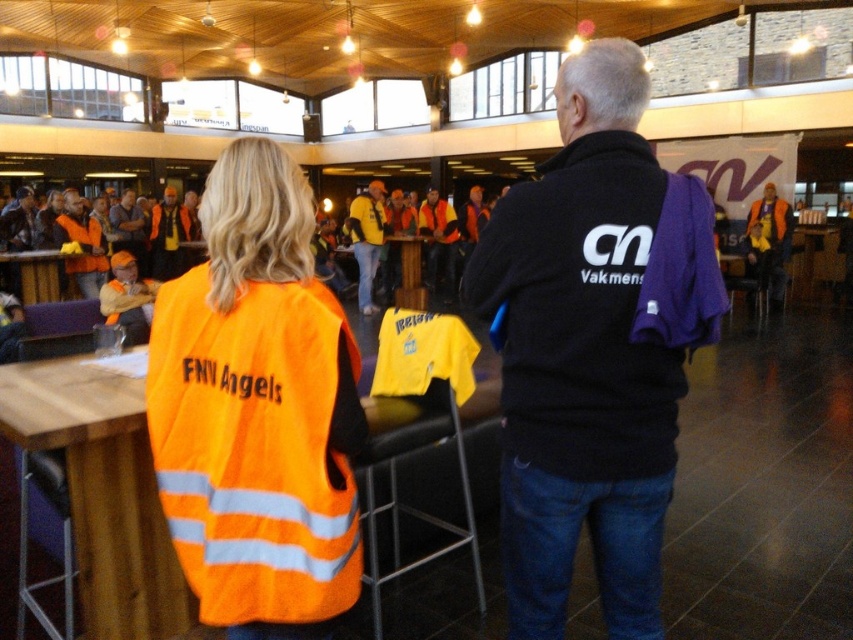
Question: Among these points, which one is nearest to the camera?

Choices:
 (A) click(x=41, y=294)
 (B) click(x=770, y=196)
 (C) click(x=401, y=272)

Answer: (A)

Question: Which point is closer to the camera?

Choices:
 (A) (196, 289)
 (B) (368, 289)
 (C) (35, 260)

Answer: (A)

Question: Is reflective orange vest at center to the right of orange reflective vest at center from the viewer's perspective?

Choices:
 (A) yes
 (B) no

Answer: (B)

Question: Is reflective orange vest at center thinner than yellow fabric shirt at center?

Choices:
 (A) yes
 (B) no

Answer: (B)

Question: Is black fleece jacket at center closer to camera compared to yellow fabric shirt at center?

Choices:
 (A) no
 (B) yes

Answer: (B)

Question: Which of the following is the farthest from the observer?

Choices:
 (A) [421, 280]
 (B) [242, 637]
 (C) [379, 193]

Answer: (A)